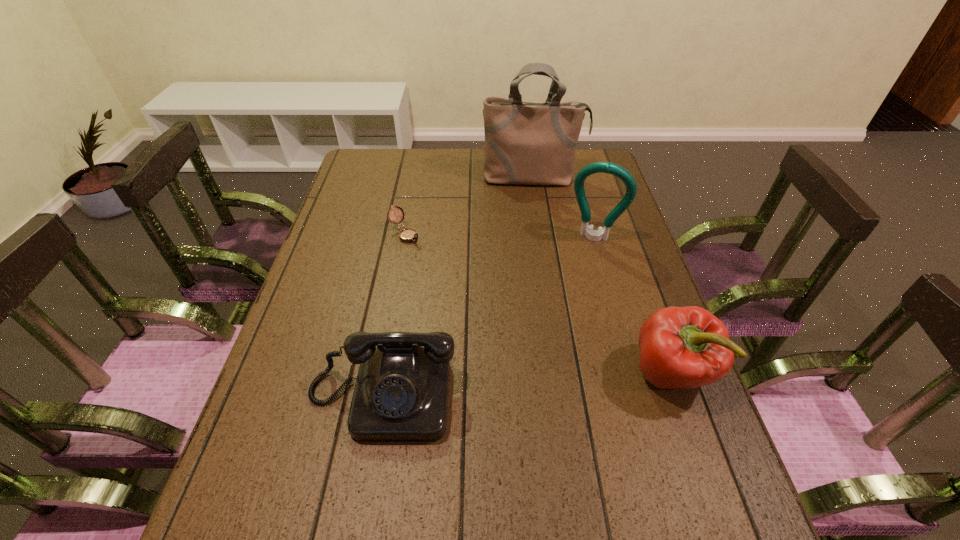
I want to click on free region at the near right corner, so click(x=692, y=477).

Locate an element on the screen. This screenshot has height=540, width=960. free point between the bottle opener and the third shortest object is located at coordinates (633, 305).

Identify the location of vacant area between the bottle opener and the telephone. (488, 316).

At what (x,y) coordinates should I click in order to perform the action: click on vacant area that lies between the second shortest object and the third tallest object. Please return your answer as a coordinate pair (x, y). Looking at the image, I should click on (526, 385).

Locate an element on the screen. This screenshot has height=540, width=960. vacant space in between the telephone and the third tallest object is located at coordinates (526, 385).

This screenshot has width=960, height=540. I want to click on unoccupied position between the third shortest object and the fourth shortest object, so click(x=633, y=305).

What are the coordinates of `free space between the farthest object and the shortest object` in the screenshot? It's located at (468, 206).

The width and height of the screenshot is (960, 540). In order to click on free space that is in between the bottle opener and the farthest object in this screenshot , I will do `click(564, 207)`.

You are a GUI agent. You are given a task and a screenshot of the screen. Output one action in this format:
    pyautogui.click(x=<x>, y=<y>)
    Task: Click on the empty location between the tallest object and the shortest object
    The image size is (960, 540).
    Given the screenshot: What is the action you would take?
    pyautogui.click(x=468, y=206)

Locate an element on the screen. free space between the shortest object and the fourth shortest object is located at coordinates (499, 235).